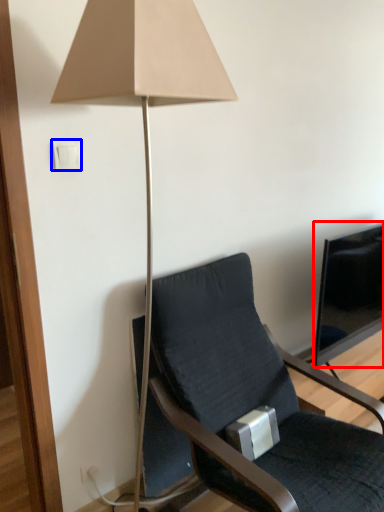
Question: Which object is closer to the camera taking this photo, television (highlighted by a red box) or light switch (highlighted by a blue box)?

Choices:
 (A) television
 (B) light switch

Answer: (B)